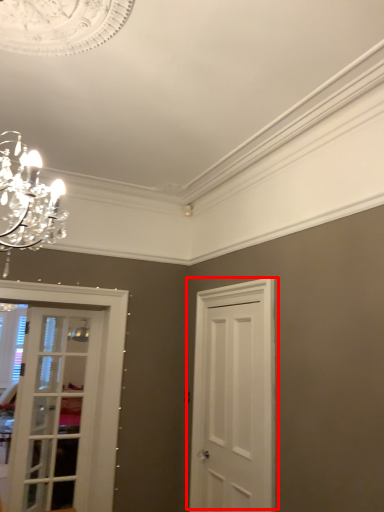
Question: From the image, what is the correct spatial relationship of door (annotated by the red box) in relation to door?

Choices:
 (A) left
 (B) right

Answer: (B)